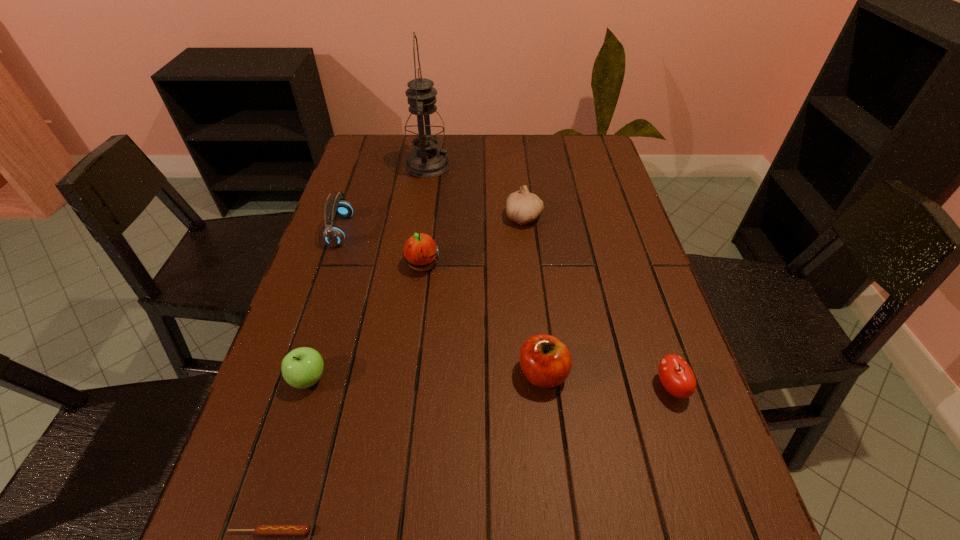
The height and width of the screenshot is (540, 960). I want to click on headset that is at the left edge, so pyautogui.click(x=338, y=206).

Locate an element on the screen. Image resolution: width=960 pixels, height=540 pixels. apple at the left edge is located at coordinates (301, 368).

Locate an element on the screen. sausage positioned at the left edge is located at coordinates (263, 529).

You are a GUI agent. You are given a task and a screenshot of the screen. Output one action in this format:
    pyautogui.click(x=<x>, y=<y>)
    Task: Click on the object positioned at the right edge
    
    Given the screenshot: What is the action you would take?
    pyautogui.click(x=676, y=376)

The height and width of the screenshot is (540, 960). What are the coordinates of `vacant area at the far edge of the desktop` in the screenshot? It's located at (x=456, y=139).

This screenshot has width=960, height=540. In order to click on vacant area at the left edge of the desktop in this screenshot , I will do `click(282, 340)`.

Find the location of a particular element. blank space at the right edge of the desktop is located at coordinates (571, 179).

The width and height of the screenshot is (960, 540). I want to click on vacant space at the far left corner of the desktop, so click(372, 146).

Image resolution: width=960 pixels, height=540 pixels. I want to click on vacant space at the far right corner, so click(589, 145).

I want to click on vacant region between the leftmost apple and the second apple from right to left, so click(426, 376).